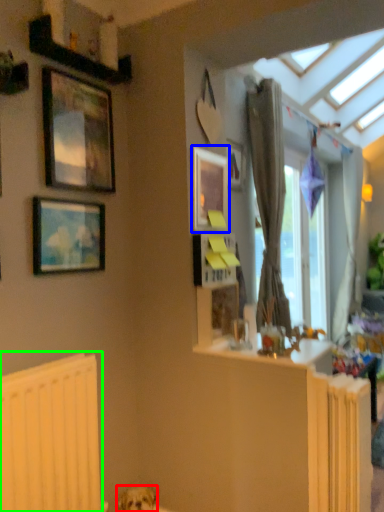
Question: Based on their relative distances, which object is farther from dog (highlighted by a red box)? Choose from picture frame (highlighted by a blue box) and radiator (highlighted by a green box).

Choices:
 (A) picture frame
 (B) radiator

Answer: (A)